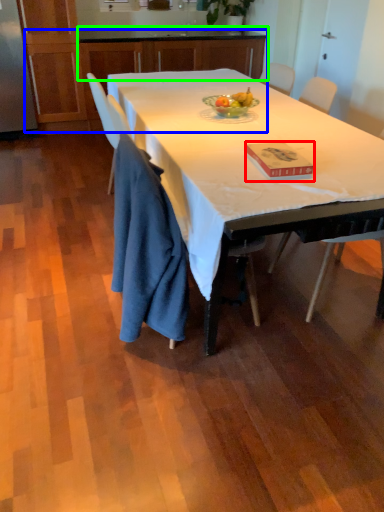
Question: Estimate the real-world distances between objects in this image. Which object is farther from book (highlighted by a red box), cabinetry (highlighted by a blue box) or cabinetry (highlighted by a green box)?

Choices:
 (A) cabinetry
 (B) cabinetry

Answer: (B)